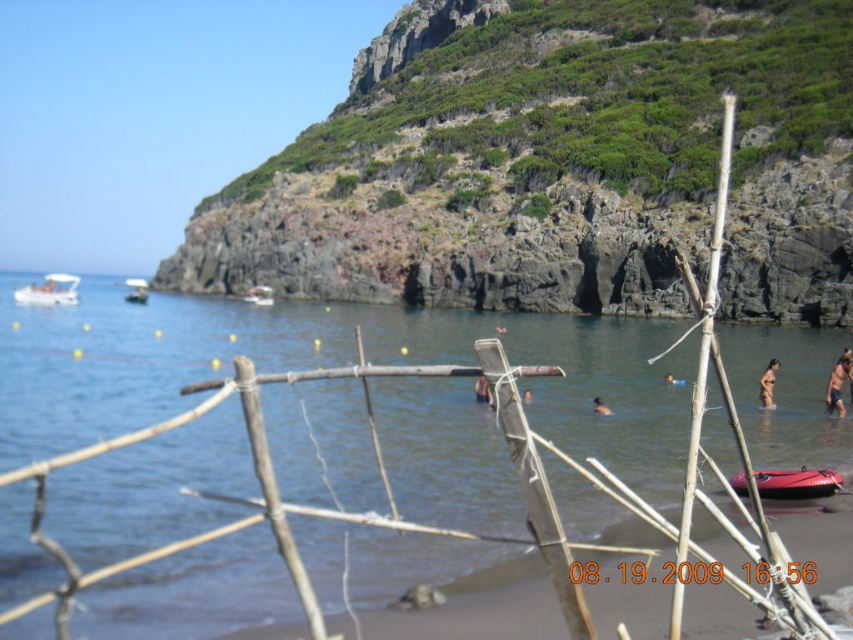
Can you confirm if white plastic boat at center is shorter than brown skin at center?

In fact, white plastic boat at center may be taller than brown skin at center.

Which of these two, white plastic boat at center or brown skin at center, stands taller?

white plastic boat at center is taller.

Measure the distance between point (271, 301) and camera.

A distance of 357.09 feet exists between point (271, 301) and camera.

Locate an element on the screen. The width and height of the screenshot is (853, 640). white plastic boat at center is located at coordinates (259, 296).

Between white plastic boat at upper left and brown skin at center, which one appears on the right side from the viewer's perspective?

Positioned to the right is brown skin at center.

This screenshot has height=640, width=853. Identify the location of white plastic boat at upper left. (136, 291).

I want to click on blue skin at center, so click(482, 390).

Does blue skin at center come behind smooth skin person at center?

No.

Identify the location of blue skin at center. Image resolution: width=853 pixels, height=640 pixels. [482, 390].